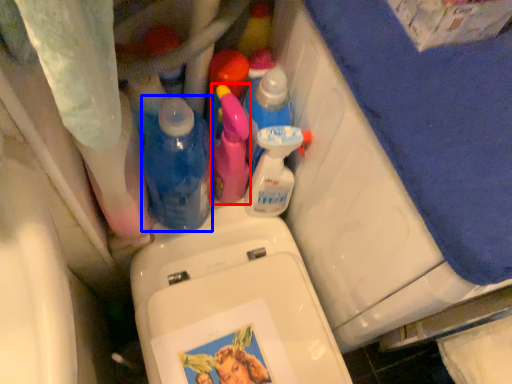
Question: Among these objects, which one is nearest to the camera, cleaning product (highlighted by a red box) or bottle (highlighted by a blue box)?

Choices:
 (A) cleaning product
 (B) bottle

Answer: (B)